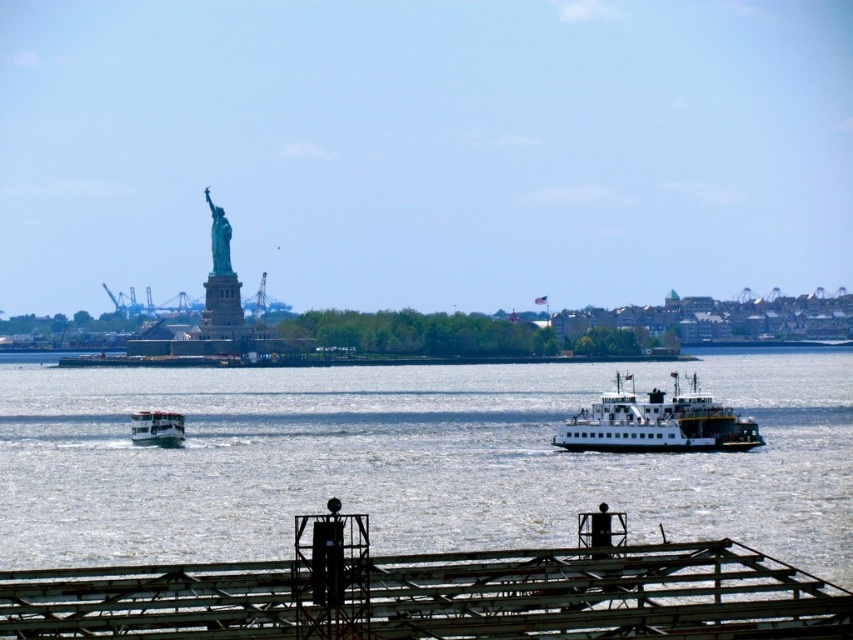
Question: Which of the following is the farthest from the observer?

Choices:
 (A) (225, 237)
 (B) (628, 392)
 (C) (138, 426)
 (D) (18, 509)

Answer: (A)

Question: Is white matte ferry at center thinner than green patina statue at upper left?

Choices:
 (A) yes
 (B) no

Answer: (B)

Question: Which point appears farthest from the camera in this image?

Choices:
 (A) (213, 259)
 (B) (142, 442)
 (C) (123, 621)

Answer: (A)

Question: Among these points, which one is farthest from the camera?

Choices:
 (A) (155, 433)
 (B) (210, 212)
 (C) (102, 513)
 (D) (541, 560)

Answer: (B)

Question: Is gray metallic water at center positioned before white matte ferry at center?

Choices:
 (A) no
 (B) yes

Answer: (B)

Question: Does gray metallic water at center appear under white matte ferry at center?

Choices:
 (A) yes
 (B) no

Answer: (B)